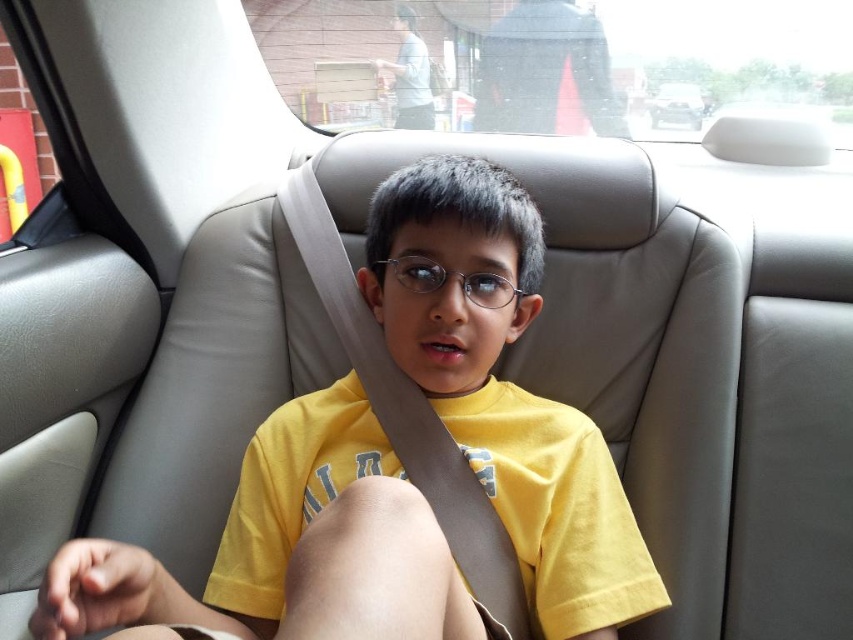
Question: Does yellow matte shirt at center have a smaller size compared to metallic silver car at upper center?

Choices:
 (A) no
 (B) yes

Answer: (A)

Question: Estimate the real-world distances between objects in this image. Which object is closer to the metallic silver car at upper center?

Choices:
 (A) yellow matte shirt at center
 (B) metallic silver glasses at center
 (C) black fabric bag at upper center

Answer: (C)

Question: Can you confirm if metallic silver glasses at center is positioned to the left of metallic silver car at upper center?

Choices:
 (A) no
 (B) yes

Answer: (B)

Question: Is yellow matte shirt at center further to the viewer compared to metallic silver glasses at center?

Choices:
 (A) no
 (B) yes

Answer: (A)

Question: Which of the following is the farthest from the observer?

Choices:
 (A) metallic silver glasses at center
 (B) yellow matte shirt at center
 (C) black fabric bag at upper center
 (D) metallic silver car at upper center

Answer: (D)

Question: Which point is farther from the camera taking this photo?

Choices:
 (A) (286, 497)
 (B) (653, 118)

Answer: (B)